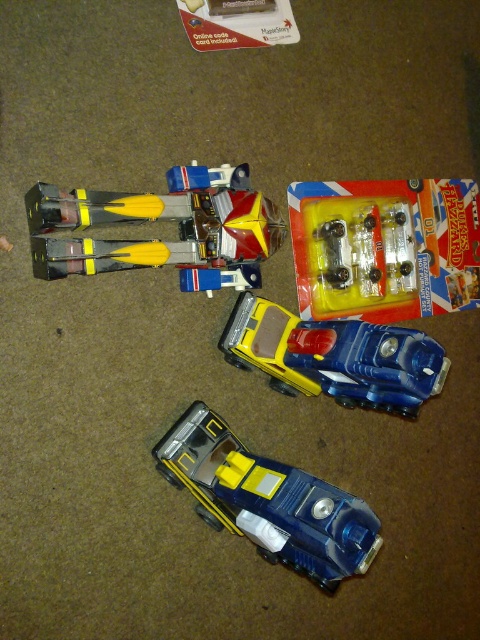
You are a child trying to fit both the clear plastic car at upper center and the glossy plastic car at center into a rectangular box. Which car should you place first to ensure both fit?

The clear plastic car at upper center might be wider than the glossy plastic car at center, so you should place the wider clear plastic car at upper center first to ensure both fit in the box.

You are a child trying to organize your toy cars. You have a clear plastic car at upper center and a glossy plastic car at center. Which car is located to the right of the other?

The clear plastic car at upper center is positioned on the right side of the glossy plastic car at center.

You are a child trying to reach both the clear plastic car at upper center and the yellow matte truck at upper center. Which one can you grab first without moving the other?

The clear plastic car at upper center can be grabbed first since the yellow matte truck at upper center is behind it and cannot be reached without moving the clear plastic car at upper center.